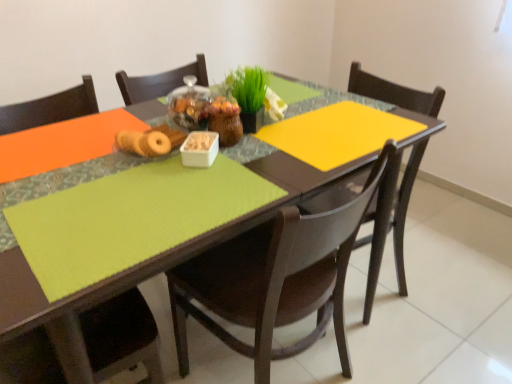
This screenshot has height=384, width=512. Identify the location of matte green placemat at lower left, which appears as the third chair when viewed from the right. (122, 336).

The width and height of the screenshot is (512, 384). What do you see at coordinates (150, 141) in the screenshot? I see `matte brown donuts at center` at bounding box center [150, 141].

Describe the element at coordinates (390, 221) in the screenshot. This screenshot has height=384, width=512. I see `matte wood chair at upper right, placed as the 1th chair when sorted from right to left` at that location.

The height and width of the screenshot is (384, 512). I want to click on green matte grass at center, so click(248, 88).

What is the approximate width of green matte grass at center?

It is 10.52 centimeters.

From the picture: Measure the distance between point (32, 370) and camera.

33.15 inches.

This screenshot has height=384, width=512. In order to click on matte green placemat at lower left, which appears as the third chair when viewed from the right in this screenshot , I will do `click(122, 336)`.

Is matte wood chair at upper right, placed as the 1th chair when sorted from right to left, far away from lime green fabric table at center?

They are positioned close to each other.

Could you tell me if matte wood chair at upper right, placed as the 1th chair when sorted from right to left, is facing lime green fabric table at center?

Yes.

Based on the photo, which is more to the right, matte wood chair at upper right, placed as the 1th chair when sorted from right to left, or lime green fabric table at center?

From the viewer's perspective, matte wood chair at upper right, placed as the 1th chair when sorted from right to left, appears more on the right side.

Locate an element on the screen. This screenshot has width=512, height=384. chair that is the 2nd object to the right of the lime green fabric table at center, starting at the anchor is located at coordinates (390, 221).

Based on the photo, which point is more distant from viewer, (319, 233) or (403, 272)?

The point (403, 272) is more distant.

Which is more to the left, matte brown chair at center, the second chair when ordered from right to left, or lime green fabric table at center?

Positioned to the left is lime green fabric table at center.

Is matte brown chair at center, acting as the 2th chair starting from the left, not near lime green fabric table at center?

That's not correct — matte brown chair at center, acting as the 2th chair starting from the left, is a little close to lime green fabric table at center.

From a real-world perspective, is matte brown chair at center, acting as the 2th chair starting from the left, under lime green fabric table at center?

No, from a real-world perspective, matte brown chair at center, acting as the 2th chair starting from the left, is not below lime green fabric table at center.

In terms of height, does matte brown chair at center, the second chair when ordered from right to left, look taller or shorter compared to matte wood chair at upper right, placed as the 1th chair when sorted from right to left?

Considering their sizes, matte brown chair at center, the second chair when ordered from right to left, has less height than matte wood chair at upper right, placed as the 1th chair when sorted from right to left.

Is matte brown chair at center, the second chair when ordered from right to left, oriented away from matte wood chair at upper right, acting as the 3th chair starting from the left?

No, matte brown chair at center, the second chair when ordered from right to left, is not facing away from matte wood chair at upper right, acting as the 3th chair starting from the left.

Looking at this image, can you confirm if matte brown chair at center, acting as the 2th chair starting from the left, is positioned to the left of matte wood chair at upper right, placed as the 1th chair when sorted from right to left?

Indeed, matte brown chair at center, acting as the 2th chair starting from the left, is positioned on the left side of matte wood chair at upper right, placed as the 1th chair when sorted from right to left.

Which is behind, point (226, 305) or point (374, 95)?

The point (374, 95) is farther from the camera.

Based on their positions, is lime green fabric table at center located to the left or right of white plastic container at center?

From the image, it's evident that lime green fabric table at center is to the left of white plastic container at center.

How many degrees apart are the facing directions of lime green fabric table at center and white plastic container at center?

The angle between the facing direction of lime green fabric table at center and the facing direction of white plastic container at center is 44.7 degrees.

In terms of size, does lime green fabric table at center appear bigger or smaller than white plastic container at center?

Considering their sizes, lime green fabric table at center takes up more space than white plastic container at center.

From the image's perspective, is lime green fabric table at center on white plastic container at center?

No.

Is lime green fabric table at center inside the boundaries of matte brown donuts at center, or outside?

lime green fabric table at center is located beyond the bounds of matte brown donuts at center.

Find the location of a particular element. table that appears below the matte brown donuts at center (from a real-world perspective) is located at coordinates (120, 329).

Considering the sizes of lime green fabric table at center and matte brown donuts at center in the image, is lime green fabric table at center bigger or smaller than matte brown donuts at center?

Clearly, lime green fabric table at center is larger in size than matte brown donuts at center.

From a real-world perspective, is white plastic container at center located higher than matte brown chair at center, the second chair when ordered from right to left?

Yes, from a real-world perspective, white plastic container at center is on top of matte brown chair at center, the second chair when ordered from right to left.

Is white plastic container at center oriented away from matte brown chair at center, the second chair when ordered from right to left?

Yes, white plastic container at center's orientation is away from matte brown chair at center, the second chair when ordered from right to left.

Between white plastic container at center and matte brown chair at center, the second chair when ordered from right to left, which one has less height?

white plastic container at center is shorter.

Is white plastic container at center inside the boundaries of matte brown chair at center, acting as the 2th chair starting from the left, or outside?

The correct answer is: inside.

Which is farther, (328,282) or (254,105)?

The point (328,282) is farther.

Is matte brown chair at center, acting as the 2th chair starting from the left, looking in the opposite direction of green matte grass at center?

No, matte brown chair at center, acting as the 2th chair starting from the left, is not facing away from green matte grass at center.

Is matte brown chair at center, acting as the 2th chair starting from the left, thinner than green matte grass at center?

No.

This screenshot has height=384, width=512. What are the coordinates of `chair located above the lime green fabric table at center (from the image's perspective)` in the screenshot? It's located at (390, 221).

From the lime green fabric table at center, count 1st chair to the right and point to it. Please provide its 2D coordinates.

[(275, 279)]

When comparing their distances from green matte grass at center, does lime green fabric table at center or matte green placemat at lower left, which appears as the third chair when viewed from the right, seem closer?

Based on the image, lime green fabric table at center appears to be nearer to green matte grass at center.

Based on their spatial positions, is matte wood chair at upper right, placed as the 1th chair when sorted from right to left, or matte green placemat at lower left, acting as the first chair starting from the left, further from white plastic container at center?

matte wood chair at upper right, placed as the 1th chair when sorted from right to left, is further to white plastic container at center.

In the scene shown: Looking at the image, which one is located further to matte brown chair at center, the second chair when ordered from right to left, green matte grass at center or lime green fabric table at center?

Based on the image, green matte grass at center appears to be further to matte brown chair at center, the second chair when ordered from right to left.

When comparing their distances from matte brown donuts at center, does matte wood chair at upper right, acting as the 3th chair starting from the left, or matte green placemat at lower left, acting as the first chair starting from the left, seem closer?

The object closer to matte brown donuts at center is matte green placemat at lower left, acting as the first chair starting from the left.

Based on the photo, estimate the real-world distances between objects in this image. Which object is further from lime green fabric table at center, matte green placemat at lower left, acting as the first chair starting from the left, or matte brown chair at center, the second chair when ordered from right to left?

matte green placemat at lower left, acting as the first chair starting from the left, lies further to lime green fabric table at center than the other object.

When comparing their distances from green matte grass at center, does matte brown donuts at center or matte wood chair at upper right, acting as the 3th chair starting from the left, seem further?

matte wood chair at upper right, acting as the 3th chair starting from the left, is further to green matte grass at center.

Estimate the real-world distances between objects in this image. Which object is closer to green matte grass at center, matte brown donuts at center or white plastic container at center?

white plastic container at center is closer to green matte grass at center.

Based on their spatial positions, is matte brown donuts at center or white plastic container at center further from matte green placemat at lower left, which appears as the third chair when viewed from the right?

white plastic container at center.

Find the location of a particular element. table between green matte grass at center and matte brown chair at center, acting as the 2th chair starting from the left, from top to bottom is located at coordinates (120, 329).

Find the location of a particular element. table between green matte grass at center and matte green placemat at lower left, acting as the first chair starting from the left, in the vertical direction is located at coordinates (120, 329).

The width and height of the screenshot is (512, 384). I want to click on food between green matte grass at center and matte brown chair at center, the second chair when ordered from right to left, from top to bottom, so click(x=150, y=141).

The image size is (512, 384). I want to click on food situated between matte green placemat at lower left, which appears as the third chair when viewed from the right, and matte wood chair at upper right, acting as the 3th chair starting from the left, from left to right, so click(150, 141).